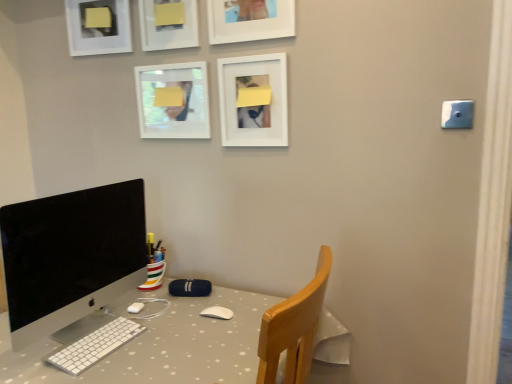
Where is `empty space that is ontop of white plastic keyboard at lower left (from a real-world perspective)`? The image size is (512, 384). empty space that is ontop of white plastic keyboard at lower left (from a real-world perspective) is located at coordinates (94, 339).